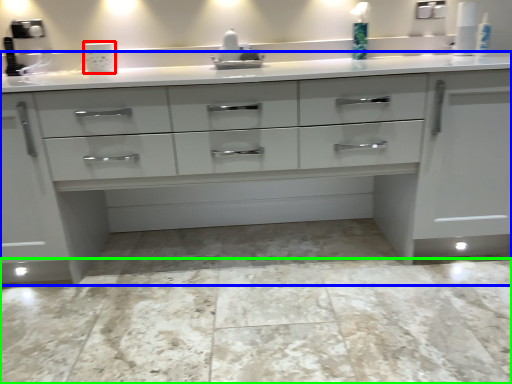
Question: Which object is the closest to the appliance (highlighted by a red box)? Choose among these: chest of drawers (highlighted by a blue box) or granite (highlighted by a green box).

Choices:
 (A) chest of drawers
 (B) granite

Answer: (A)